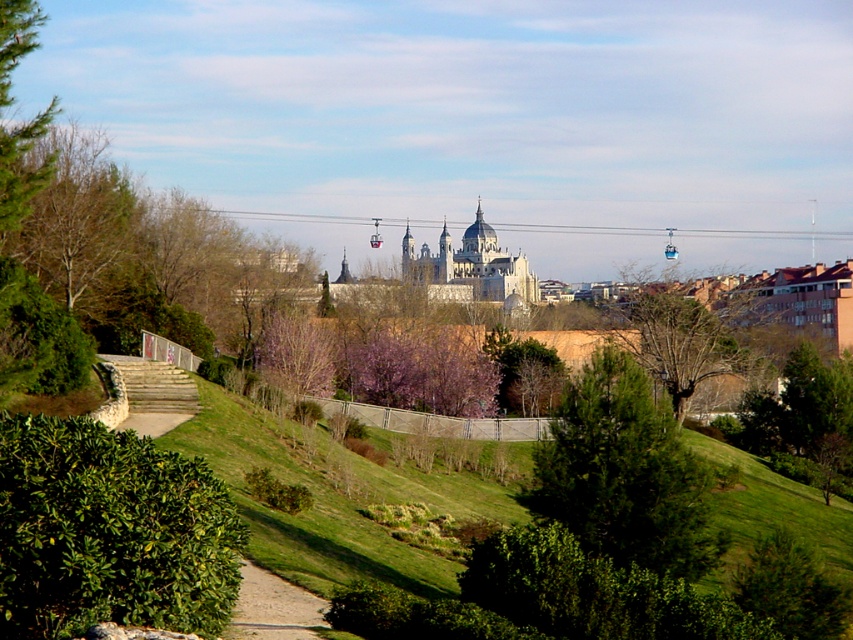
Does white stone castle at center appear on the right side of dirt/gravel path at lower center?

Yes, white stone castle at center is to the right of dirt/gravel path at lower center.

Is point (469, 257) farther from viewer compared to point (277, 589)?

That is True.

Identify the location of white stone castle at center. (473, 266).

Is green needle-like at center bigger than pink textured tree at center?

Incorrect, green needle-like at center is not larger than pink textured tree at center.

Is point (614, 532) farther from camera compared to point (303, 332)?

No, (614, 532) is closer to viewer.

This screenshot has width=853, height=640. I want to click on green needle-like at center, so click(625, 474).

Who is more forward, (277, 365) or (236, 618)?

Positioned in front is point (236, 618).

Is pink textured tree at center above dirt/gravel path at lower center?

Yes.

Which is in front, point (312, 358) or point (238, 620)?

Point (238, 620) is more forward.

This screenshot has height=640, width=853. I want to click on pink textured tree at center, so click(x=297, y=353).